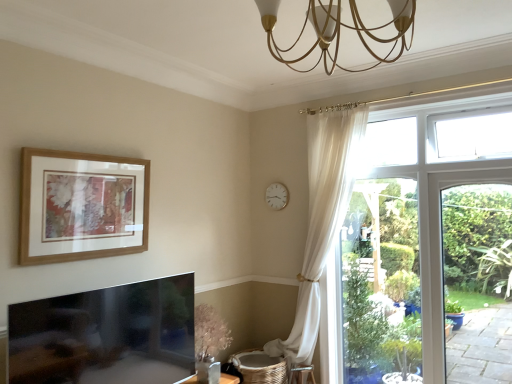
Question: From the image's perspective, is white plastic clock at upper center on wooden picture frame at upper left?

Choices:
 (A) no
 (B) yes

Answer: (B)

Question: Is wooden picture frame at upper left inside white plastic clock at upper center?

Choices:
 (A) yes
 (B) no

Answer: (B)

Question: Does white plastic clock at upper center turn towards wooden picture frame at upper left?

Choices:
 (A) no
 (B) yes

Answer: (B)

Question: Can you confirm if white plastic clock at upper center is positioned to the right of wooden picture frame at upper left?

Choices:
 (A) no
 (B) yes

Answer: (B)

Question: Does white plastic clock at upper center have a greater width compared to wooden picture frame at upper left?

Choices:
 (A) no
 (B) yes

Answer: (A)

Question: Can you confirm if white plastic clock at upper center is thinner than wooden picture frame at upper left?

Choices:
 (A) no
 (B) yes

Answer: (B)

Question: Is white plastic clock at upper center wider than gold metallic chandelier at upper center?

Choices:
 (A) yes
 (B) no

Answer: (B)

Question: From the image's perspective, is white plastic clock at upper center above gold metallic chandelier at upper center?

Choices:
 (A) no
 (B) yes

Answer: (A)

Question: Is white plastic clock at upper center further to camera compared to gold metallic chandelier at upper center?

Choices:
 (A) yes
 (B) no

Answer: (A)

Question: Can you confirm if white plastic clock at upper center is smaller than gold metallic chandelier at upper center?

Choices:
 (A) no
 (B) yes

Answer: (B)

Question: From the image's perspective, is white plastic clock at upper center below gold metallic chandelier at upper center?

Choices:
 (A) yes
 (B) no

Answer: (A)

Question: Considering the relative positions of white plastic clock at upper center and gold metallic chandelier at upper center in the image provided, is white plastic clock at upper center to the right of gold metallic chandelier at upper center from the viewer's perspective?

Choices:
 (A) yes
 (B) no

Answer: (B)

Question: Is wooden picture frame at upper left smaller than white plastic clock at upper center?

Choices:
 (A) yes
 (B) no

Answer: (B)